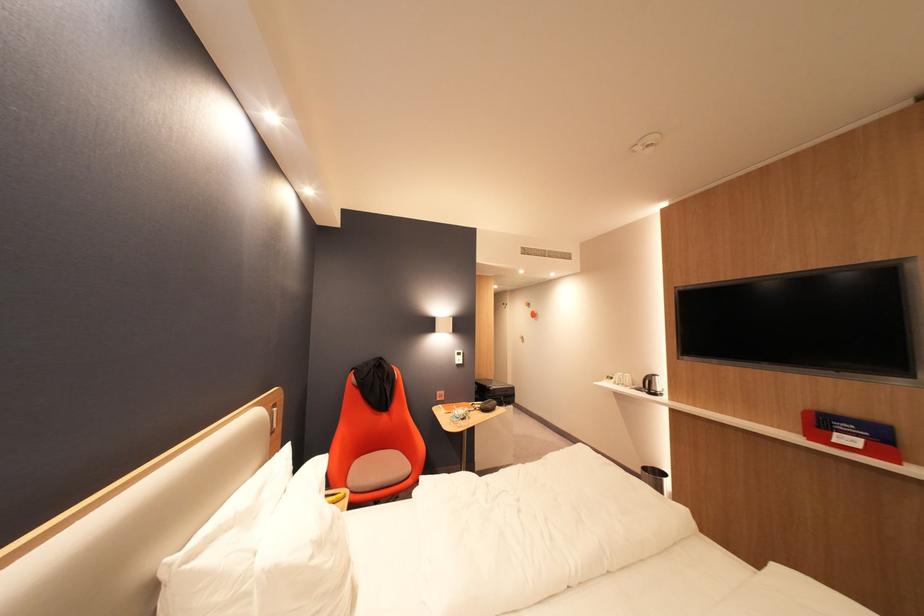
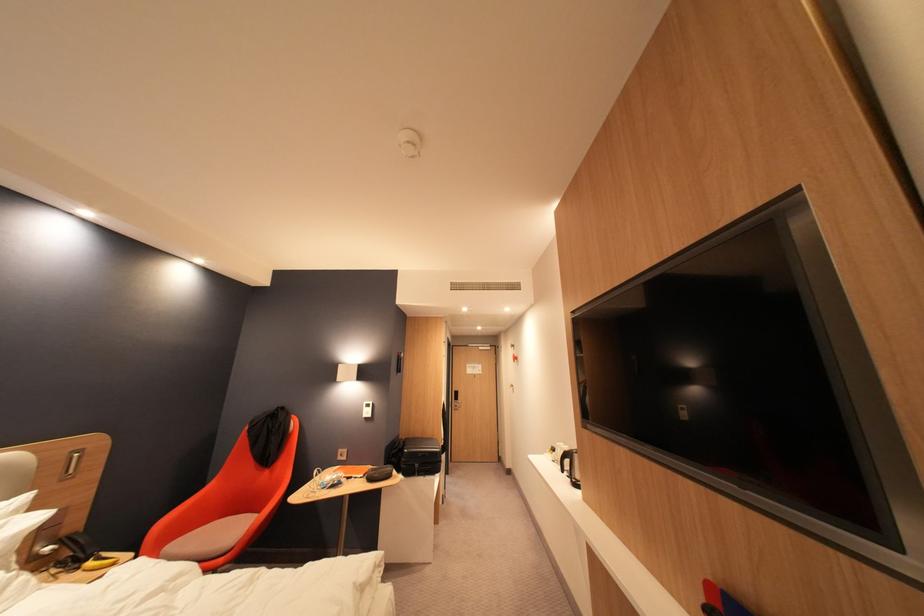
Question: I am providing you with two images of the same scene from different viewpoints. After the viewpoint changes to image2, which objects are now occluded?

Choices:
 (A) black kettle handle
 (B) black case
 (C) suitcase handle
 (D) none of these

Answer: (D)